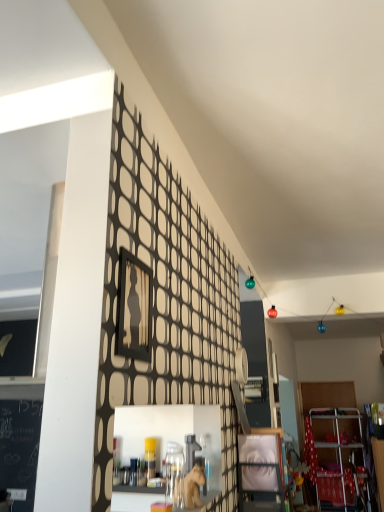
Question: Is wooden picture frame at center to the left of matte wooden frame at center from the viewer's perspective?

Choices:
 (A) no
 (B) yes

Answer: (B)

Question: Is wooden picture frame at center closer to camera compared to matte wooden frame at center?

Choices:
 (A) yes
 (B) no

Answer: (A)

Question: Considering the relative sizes of wooden picture frame at center and matte wooden frame at center in the image provided, is wooden picture frame at center shorter than matte wooden frame at center?

Choices:
 (A) no
 (B) yes

Answer: (A)

Question: Is wooden picture frame at center facing away from matte wooden frame at center?

Choices:
 (A) yes
 (B) no

Answer: (B)

Question: From the image's perspective, would you say wooden picture frame at center is shown under matte wooden frame at center?

Choices:
 (A) no
 (B) yes

Answer: (A)

Question: Could you tell me if wooden picture frame at center is turned towards matte wooden frame at center?

Choices:
 (A) no
 (B) yes

Answer: (A)

Question: Is matte wooden frame at center behind wooden picture frame at center?

Choices:
 (A) no
 (B) yes

Answer: (B)

Question: Is matte wooden frame at center positioned with its back to wooden picture frame at center?

Choices:
 (A) no
 (B) yes

Answer: (A)

Question: Considering the relative sizes of matte wooden frame at center and wooden picture frame at center in the image provided, is matte wooden frame at center taller than wooden picture frame at center?

Choices:
 (A) yes
 (B) no

Answer: (B)

Question: From the image's perspective, is matte wooden frame at center below wooden picture frame at center?

Choices:
 (A) no
 (B) yes

Answer: (B)

Question: Is matte wooden frame at center positioned in front of wooden picture frame at center?

Choices:
 (A) no
 (B) yes

Answer: (A)

Question: From the image's perspective, is matte wooden frame at center over wooden picture frame at center?

Choices:
 (A) no
 (B) yes

Answer: (A)

Question: Relative to matte wooden frame at center, is wooden picture frame at center in front or behind?

Choices:
 (A) front
 (B) behind

Answer: (A)